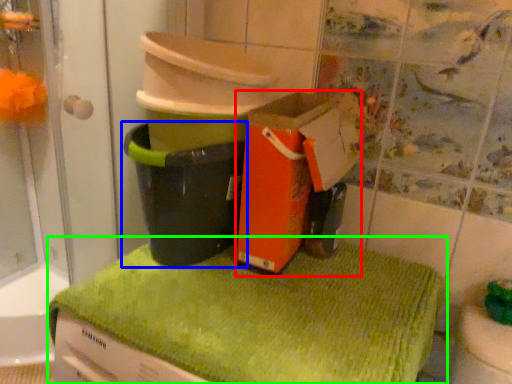
Question: Considering the real-world distances, which object is farthest from cardboard box (highlighted by a red box)? waste container (highlighted by a blue box) or bath towel (highlighted by a green box)?

Choices:
 (A) waste container
 (B) bath towel

Answer: (B)